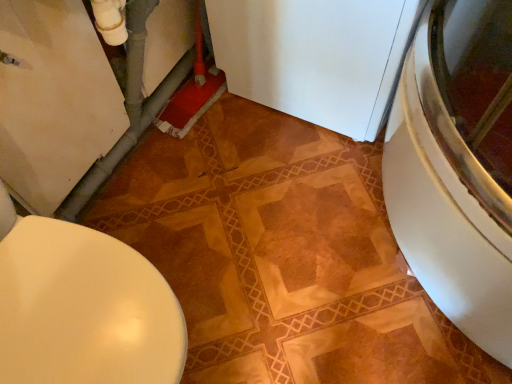
Question: Is white matte refrigerator at center bigger or smaller than matte white toilet at lower left?

Choices:
 (A) big
 (B) small

Answer: (A)

Question: In terms of height, does white matte refrigerator at center look taller or shorter compared to matte white toilet at lower left?

Choices:
 (A) short
 (B) tall

Answer: (B)

Question: From a real-world perspective, is white matte refrigerator at center positioned above or below matte white toilet at lower left?

Choices:
 (A) above
 (B) below

Answer: (B)

Question: In the image, is matte white toilet at lower left positioned in front of or behind white matte refrigerator at center?

Choices:
 (A) behind
 (B) front

Answer: (B)

Question: In terms of height, does matte white toilet at lower left look taller or shorter compared to white matte refrigerator at center?

Choices:
 (A) tall
 (B) short

Answer: (B)

Question: Do you think matte white toilet at lower left is within white matte refrigerator at center, or outside of it?

Choices:
 (A) inside
 (B) outside

Answer: (B)

Question: Is matte white toilet at lower left to the left or to the right of white matte refrigerator at center in the image?

Choices:
 (A) right
 (B) left

Answer: (B)